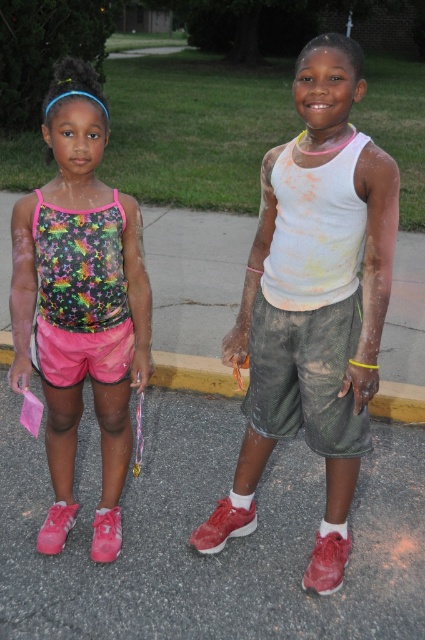
You are a drone operator who needs to fly a drone from the dark green mesh shorts at center to the yellow concrete curb at center. The drone has a maximum flight distance of 2 meters. Can the drone reach the curb from the shorts?

The dark green mesh shorts at center is 1.83 meters from the yellow concrete curb at center. Since the drone can fly up to 2 meters, it can successfully reach the curb from the shorts.

Looking at this image, based on the scene description, can you determine if the dark green mesh shorts at center are resting on or elevated above the yellow concrete curb at center?

The dark green mesh shorts at center is above yellow concrete curb at center, so it is elevated and not resting on it.